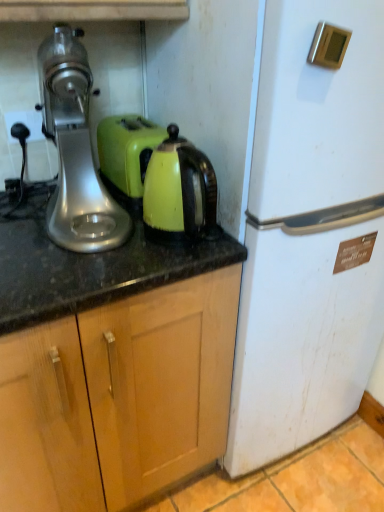
Measure the distance between point (316, 406) and camera.

A distance of 1.40 meters exists between point (316, 406) and camera.

I want to click on wooden cabinet at center, so click(x=118, y=397).

Who is smaller, wooden cabinet at center or white matte refrigerator at right?

wooden cabinet at center.

Considering the sizes of objects wooden cabinet at center and white matte refrigerator at right in the image provided, who is wider, wooden cabinet at center or white matte refrigerator at right?

Wider between the two is wooden cabinet at center.

Which of these two, wooden cabinet at center or white matte refrigerator at right, stands shorter?

Standing shorter between the two is wooden cabinet at center.

Between wooden cabinet at center and matte green kettle at center, which one has larger width?

wooden cabinet at center.

From the picture: Measure the distance between wooden cabinet at center and matte green kettle at center.

wooden cabinet at center is 14.59 inches from matte green kettle at center.

From the image's perspective, between wooden cabinet at center and matte green kettle at center, which one is located above?

matte green kettle at center is shown above in the image.

Considering the relative positions of matte green kettle at center and silver metallic plug at left in the image provided, is matte green kettle at center to the left or to the right of silver metallic plug at left?

From the image, it's evident that matte green kettle at center is to the right of silver metallic plug at left.

Are matte green kettle at center and silver metallic plug at left far apart?

That's not correct — matte green kettle at center is a little close to silver metallic plug at left.

Is matte green kettle at center located outside silver metallic plug at left?

Yes.

Is matte green kettle at center closer to the viewer compared to silver metallic plug at left?

Yes, the depth of matte green kettle at center is less than that of silver metallic plug at left.

Is silver metallic stand mixer at left thinner than matte green kettle at center?

No, silver metallic stand mixer at left is not thinner than matte green kettle at center.

From a real-world perspective, is silver metallic stand mixer at left on matte green kettle at center?

Yes, from a real-world perspective, silver metallic stand mixer at left is above matte green kettle at center.

Is silver metallic stand mixer at left looking in the opposite direction of matte green kettle at center?

No.

Does silver metallic stand mixer at left come in front of white matte refrigerator at right?

No, silver metallic stand mixer at left is further to the viewer.

Between silver metallic stand mixer at left and white matte refrigerator at right, which one appears on the left side from the viewer's perspective?

silver metallic stand mixer at left.

Is the surface of silver metallic stand mixer at left in direct contact with white matte refrigerator at right?

No, silver metallic stand mixer at left is not making contact with white matte refrigerator at right.

Between silver metallic stand mixer at left and white matte refrigerator at right, which one has smaller size?

silver metallic stand mixer at left.

From a real-world perspective, is silver metallic stand mixer at left located higher than silver metallic plug at left?

Yes, from a real-world perspective, silver metallic stand mixer at left is over silver metallic plug at left

Which of these two, silver metallic stand mixer at left or silver metallic plug at left, stands shorter?

With less height is silver metallic plug at left.

Would you say silver metallic plug at left is part of silver metallic stand mixer at left's contents?

That's incorrect, silver metallic plug at left is not inside silver metallic stand mixer at left.

From the image's perspective, is silver metallic stand mixer at left positioned above or below silver metallic plug at left?

From the image's perspective, silver metallic stand mixer at left appears below silver metallic plug at left.

From a real-world perspective, is silver metallic plug at left physically below wooden cabinet at center?

Incorrect, from a real-world perspective, silver metallic plug at left is higher than wooden cabinet at center.

This screenshot has width=384, height=512. In order to click on electric outlet positioned vertically above the wooden cabinet at center (from a real-world perspective) in this screenshot , I will do `click(25, 124)`.

Does silver metallic plug at left turn towards wooden cabinet at center?

No, silver metallic plug at left is not turned towards wooden cabinet at center.

At what (x,y) coordinates should I click in order to perform the action: click on refrigerator above the wooden cabinet at center (from the image's perspective). Please return your answer as a coordinate pair (x, y). Looking at the image, I should click on (310, 234).

The image size is (384, 512). Identify the location of kitchen appliance above the wooden cabinet at center (from a real-world perspective). (179, 190).

Estimate the real-world distances between objects in this image. Which object is further from silver metallic plug at left, wooden cabinet at center or white matte refrigerator at right?

white matte refrigerator at right.

Which object lies nearer to the anchor point silver metallic stand mixer at left, white matte refrigerator at right or silver metallic plug at left?

silver metallic plug at left is positioned closer to the anchor silver metallic stand mixer at left.

Looking at the image, which one is located closer to wooden cabinet at center, silver metallic stand mixer at left or white matte refrigerator at right?

white matte refrigerator at right lies closer to wooden cabinet at center than the other object.

Looking at the image, which one is located further to silver metallic stand mixer at left, matte green kettle at center or wooden cabinet at center?

Based on the image, wooden cabinet at center appears to be further to silver metallic stand mixer at left.

When comparing their distances from silver metallic plug at left, does wooden cabinet at center or silver metallic stand mixer at left seem further?

wooden cabinet at center is further to silver metallic plug at left.

From the image, which object appears to be nearer to matte green kettle at center, silver metallic stand mixer at left or silver metallic plug at left?

Among the two, silver metallic stand mixer at left is located nearer to matte green kettle at center.

Considering their positions, is silver metallic plug at left positioned further to wooden cabinet at center than silver metallic stand mixer at left?

The object further to wooden cabinet at center is silver metallic plug at left.

Which object lies nearer to the anchor point wooden cabinet at center, silver metallic stand mixer at left or silver metallic plug at left?

Among the two, silver metallic stand mixer at left is located nearer to wooden cabinet at center.

The image size is (384, 512). Find the location of `kitchen appliance between silver metallic stand mixer at left and white matte refrigerator at right in the horizontal direction`. kitchen appliance between silver metallic stand mixer at left and white matte refrigerator at right in the horizontal direction is located at coordinates (179, 190).

What are the coordinates of `home appliance between wooden cabinet at center and white matte refrigerator at right from left to right` in the screenshot? It's located at (75, 150).

The image size is (384, 512). Identify the location of cabinetry located between silver metallic plug at left and white matte refrigerator at right in the left-right direction. (118, 397).

Where is `kitchen appliance that lies between silver metallic stand mixer at left and wooden cabinet at center from top to bottom`? This screenshot has height=512, width=384. kitchen appliance that lies between silver metallic stand mixer at left and wooden cabinet at center from top to bottom is located at coordinates (179, 190).